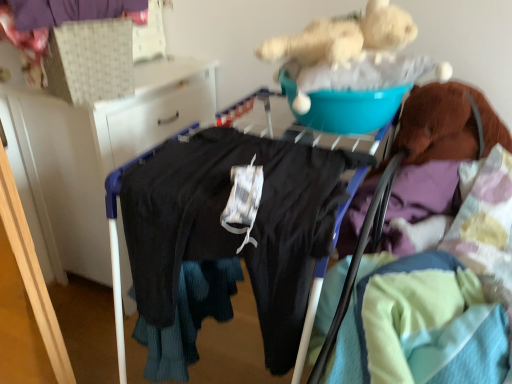
Question: From a real-world perspective, is purple fabric at upper left, which ranks as the second clothing in right-to-left order, above or below black fabric at left?

Choices:
 (A) below
 (B) above

Answer: (B)

Question: Is purple fabric at upper left, which is counted as the 2th clothing, starting from the bottom, inside or outside of black fabric at left?

Choices:
 (A) inside
 (B) outside

Answer: (B)

Question: Which object is the farthest from the black matte pants at center, which appears as the 1th clothing when viewed from the right?

Choices:
 (A) purple fabric at upper left, which ranks as the second clothing in right-to-left order
 (B) black fabric at left

Answer: (A)

Question: Estimate the real-world distances between objects in this image. Which object is farther from the black matte pants at center, placed as the second clothing when sorted from left to right?

Choices:
 (A) black fabric at left
 (B) purple fabric at upper left, which ranks as the second clothing in right-to-left order

Answer: (B)